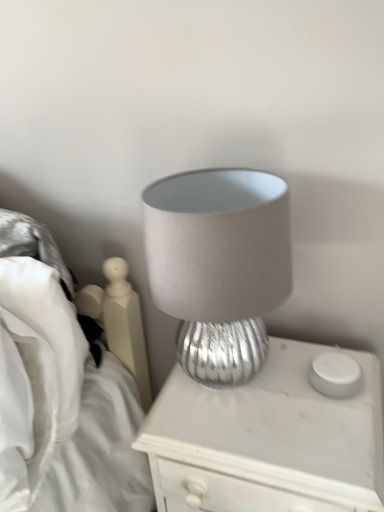
The height and width of the screenshot is (512, 384). Find the location of `vacant space behind white matte candle holder at right`. vacant space behind white matte candle holder at right is located at coordinates (309, 344).